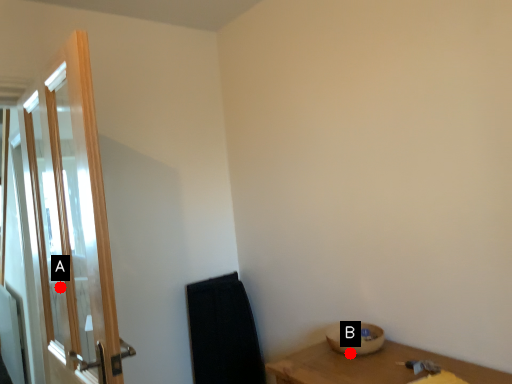
Question: Two points are circled on the image, labeled by A and B beside each circle. Which point is closer to the camera?

Choices:
 (A) A is closer
 (B) B is closer

Answer: (B)